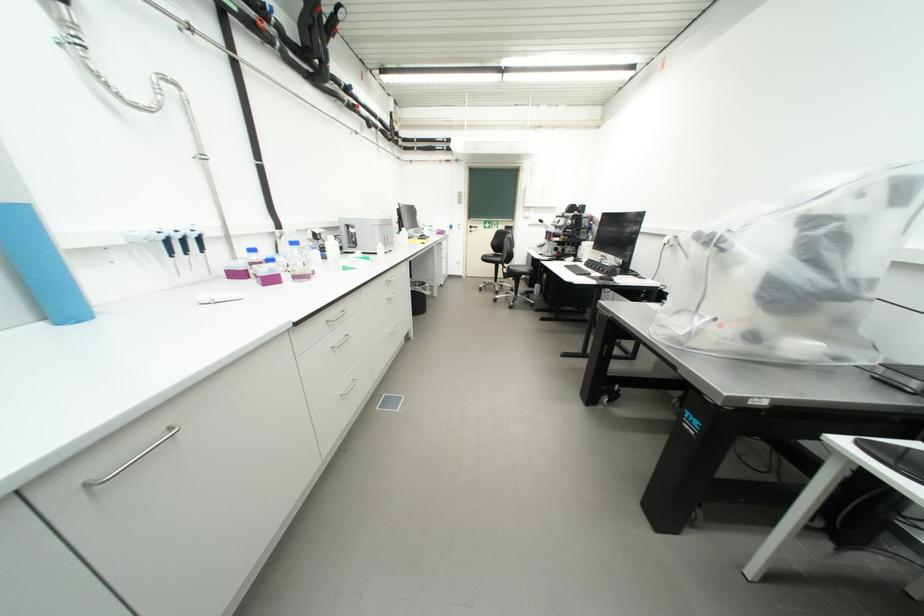
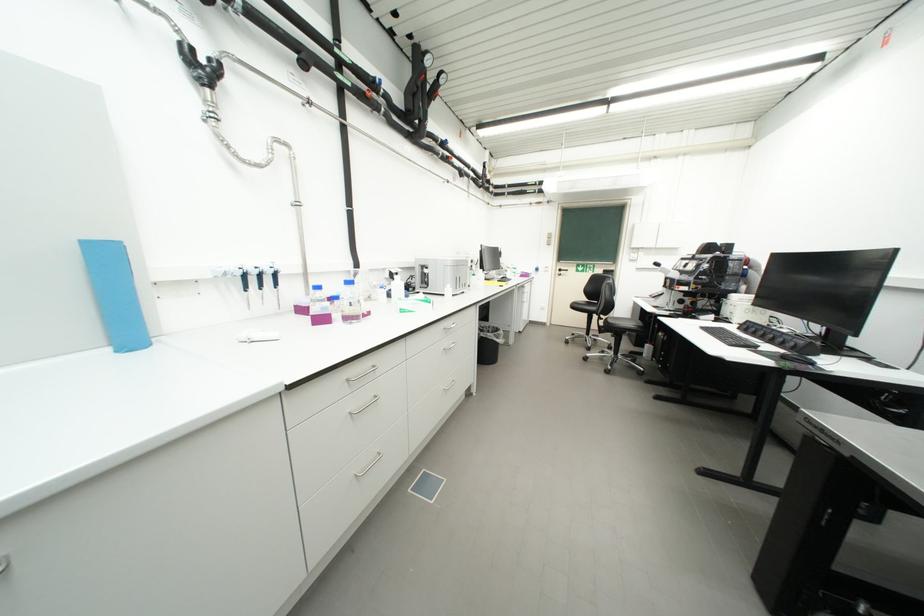
Where in the second image is the point corresponding to [609,280] from the first image?

(792, 359)